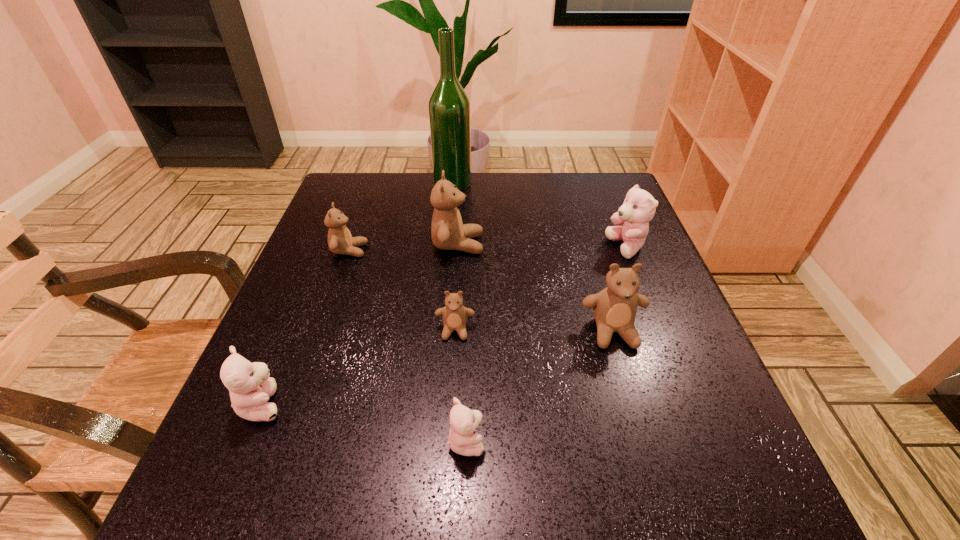
Where is `free space located 0.350m at the face of the second pink teddy bear from left to right`? free space located 0.350m at the face of the second pink teddy bear from left to right is located at coordinates (712, 441).

At what (x,y) coordinates should I click in order to perform the action: click on object that is at the far edge. Please return your answer as a coordinate pair (x, y). This screenshot has width=960, height=540. Looking at the image, I should click on (449, 107).

This screenshot has width=960, height=540. Find the location of `vacant space at the far edge of the desktop`. vacant space at the far edge of the desktop is located at coordinates (559, 190).

Where is `blank space at the near edge of the desktop`? Image resolution: width=960 pixels, height=540 pixels. blank space at the near edge of the desktop is located at coordinates (316, 529).

You are a GUI agent. You are given a task and a screenshot of the screen. Output one action in this format:
    pyautogui.click(x=<x>, y=<y>)
    Task: Click on the vacant space at the left edge of the desktop
    
    Given the screenshot: What is the action you would take?
    pyautogui.click(x=224, y=438)

Locate an element on the screen. This screenshot has height=540, width=960. free space at the right edge is located at coordinates (615, 334).

Find the location of a particular element. This screenshot has width=960, height=540. vacant space at the far left corner of the desktop is located at coordinates (349, 197).

You are a GUI agent. You are given a task and a screenshot of the screen. Output one action in this format:
    pyautogui.click(x=<x>, y=<y>)
    Task: Click on the vacant area at the near left corner
    
    Given the screenshot: What is the action you would take?
    pyautogui.click(x=219, y=478)

You are a GUI agent. You are given a task and a screenshot of the screen. Output one action in this format:
    pyautogui.click(x=<x>, y=<y>)
    Task: Click on the vacant region at the far right corner
    The width and height of the screenshot is (960, 540).
    Given the screenshot: What is the action you would take?
    pyautogui.click(x=582, y=213)

What are the coordinates of `free spot between the rightmost pink teddy bear and the second smallest brown teddy bear` in the screenshot? It's located at (488, 249).